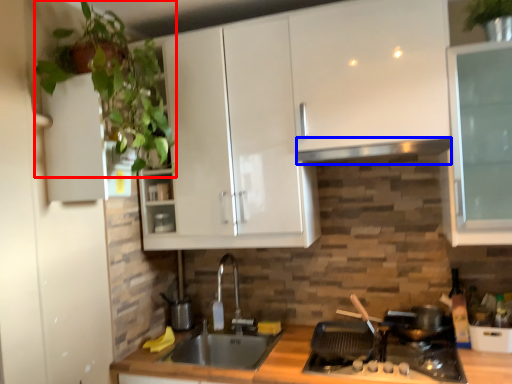
Question: Which object appears closest to the camera in this image, plant (highlighted by a red box) or exhaust hood (highlighted by a blue box)?

Choices:
 (A) plant
 (B) exhaust hood

Answer: (A)